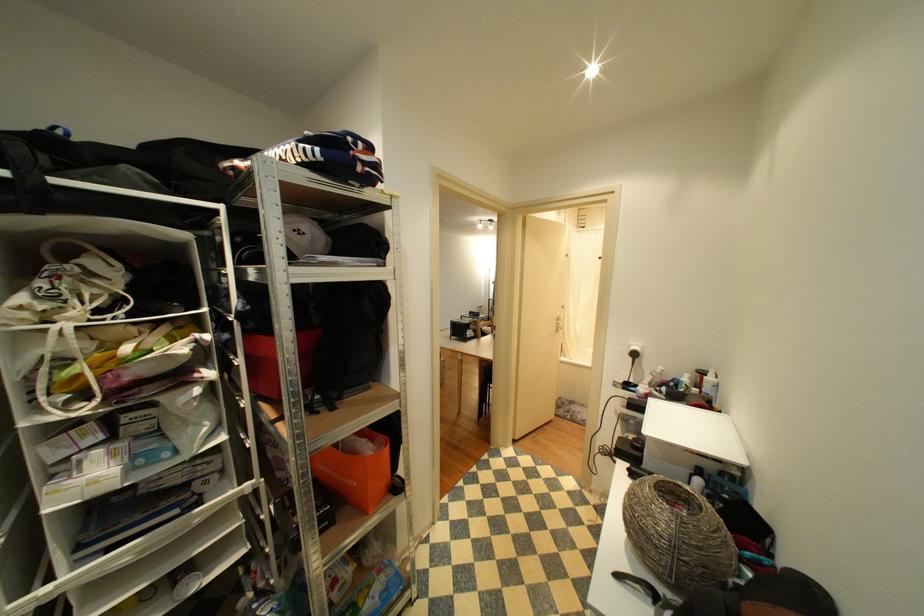
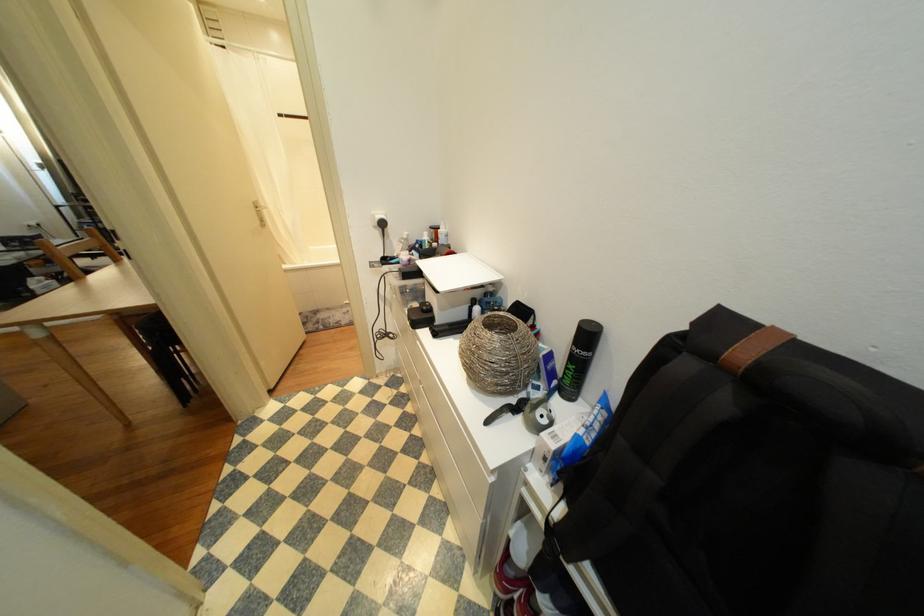
Locate, in the second image, the point that corresponds to point 614,456 in the first image.

(392, 339)